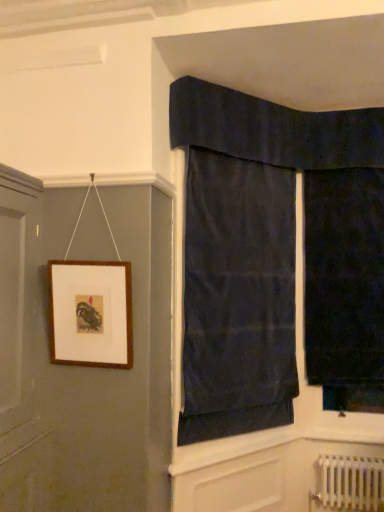
Question: Is dark blue fabric at upper center, the 1th curtain from the left, smaller than white metallic radiator at lower right?

Choices:
 (A) yes
 (B) no

Answer: (B)

Question: Is dark blue fabric at upper center, marked as the 2th curtain in a right-to-left arrangement, oriented away from white metallic radiator at lower right?

Choices:
 (A) no
 (B) yes

Answer: (A)

Question: Is dark blue fabric at upper center, the 1th curtain from the left, far away from white metallic radiator at lower right?

Choices:
 (A) no
 (B) yes

Answer: (B)

Question: Is dark blue fabric at upper center, marked as the 2th curtain in a right-to-left arrangement, closer to the viewer compared to white metallic radiator at lower right?

Choices:
 (A) yes
 (B) no

Answer: (A)

Question: Does dark blue fabric at upper center, marked as the 2th curtain in a right-to-left arrangement, turn towards white metallic radiator at lower right?

Choices:
 (A) yes
 (B) no

Answer: (B)

Question: Considering the positions of point (354, 504) and point (370, 170), is point (354, 504) closer or farther from the camera than point (370, 170)?

Choices:
 (A) closer
 (B) farther

Answer: (A)

Question: Considering the positions of white metallic radiator at lower right and dark velvet curtain at right, the second curtain in the left-to-right sequence, in the image, is white metallic radiator at lower right wider or thinner than dark velvet curtain at right, the second curtain in the left-to-right sequence,?

Choices:
 (A) thin
 (B) wide

Answer: (A)

Question: In the image, is white metallic radiator at lower right positioned in front of or behind dark velvet curtain at right, the first curtain when ordered from right to left?

Choices:
 (A) behind
 (B) front

Answer: (B)

Question: Do you think white metallic radiator at lower right is within dark velvet curtain at right, the second curtain in the left-to-right sequence, or outside of it?

Choices:
 (A) inside
 (B) outside

Answer: (B)

Question: Is brown wooden picture frame at upper left situated inside dark velvet curtain at right, the second curtain in the left-to-right sequence, or outside?

Choices:
 (A) outside
 (B) inside

Answer: (A)

Question: Is brown wooden picture frame at upper left to the left or to the right of dark velvet curtain at right, the first curtain when ordered from right to left, in the image?

Choices:
 (A) left
 (B) right

Answer: (A)

Question: From a real-world perspective, is brown wooden picture frame at upper left physically located above or below dark velvet curtain at right, the first curtain when ordered from right to left?

Choices:
 (A) above
 (B) below

Answer: (B)

Question: In terms of height, does brown wooden picture frame at upper left look taller or shorter compared to dark velvet curtain at right, the first curtain when ordered from right to left?

Choices:
 (A) short
 (B) tall

Answer: (A)

Question: Considering the positions of white metallic radiator at lower right and dark blue fabric at upper center, the 1th curtain from the left, in the image, is white metallic radiator at lower right bigger or smaller than dark blue fabric at upper center, the 1th curtain from the left,?

Choices:
 (A) small
 (B) big

Answer: (A)

Question: Looking at their shapes, would you say white metallic radiator at lower right is wider or thinner than dark blue fabric at upper center, the 1th curtain from the left?

Choices:
 (A) thin
 (B) wide

Answer: (B)